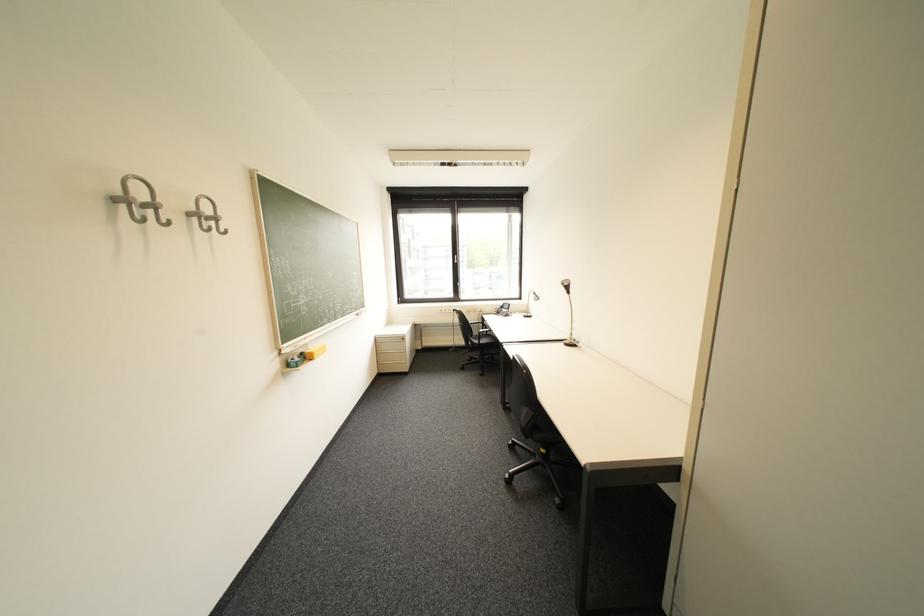
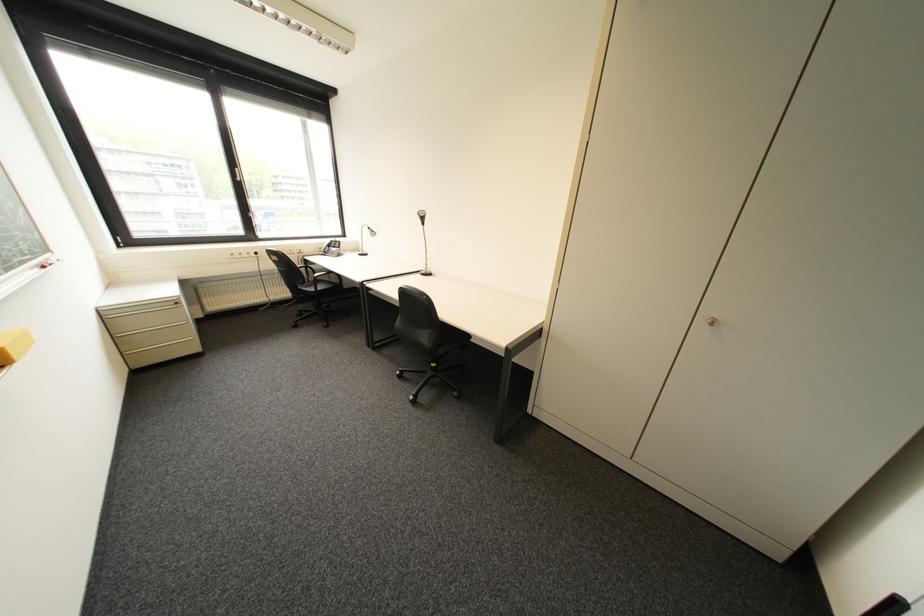
Where in the second image is the point corresponding to point 467,262 from the first image?

(249, 180)